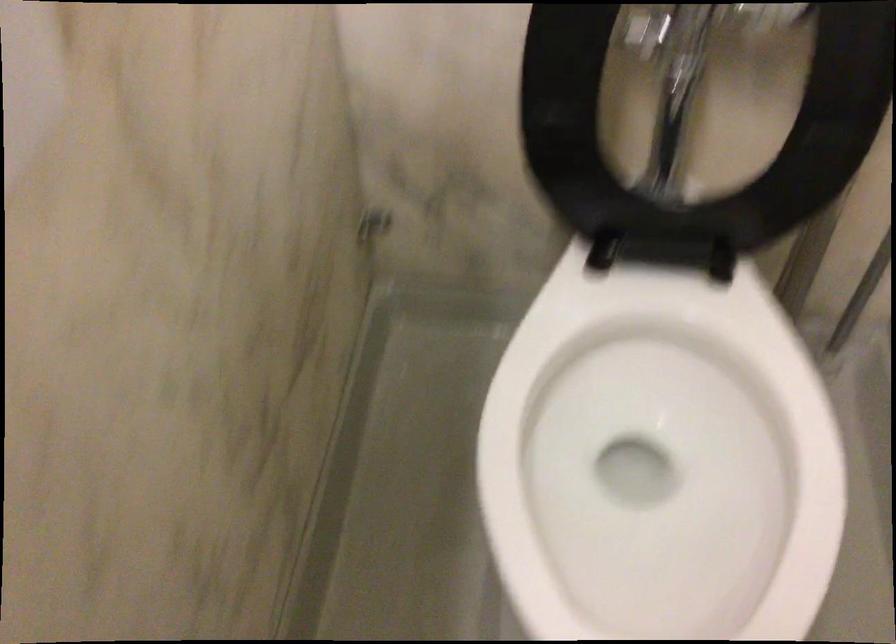
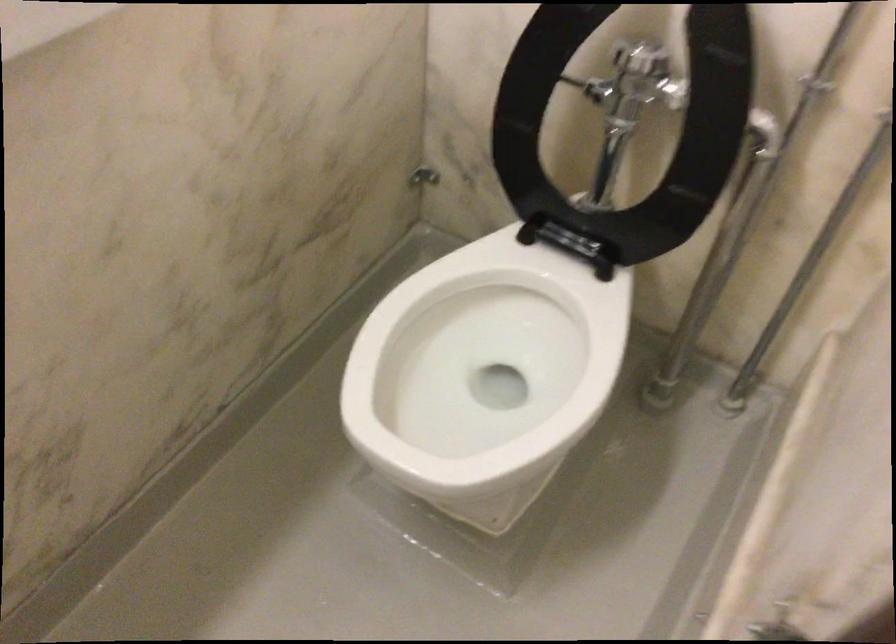
Locate, in the second image, the point that corresponds to (x=607, y=446) in the first image.

(481, 366)